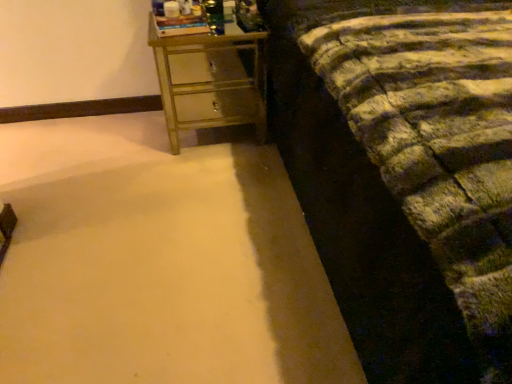
What do you see at coordinates (208, 81) in the screenshot? I see `gold metallic chest of drawers at upper left` at bounding box center [208, 81].

You are a GUI agent. You are given a task and a screenshot of the screen. Output one action in this format:
    pyautogui.click(x=<x>, y=<y>)
    Task: Click on the gold metallic chest of drawers at upper left
    Image resolution: width=512 pixels, height=384 pixels.
    Given the screenshot: What is the action you would take?
    pyautogui.click(x=208, y=81)

What are the coordinates of `gold metallic chest of drawers at upper left` in the screenshot? It's located at (208, 81).